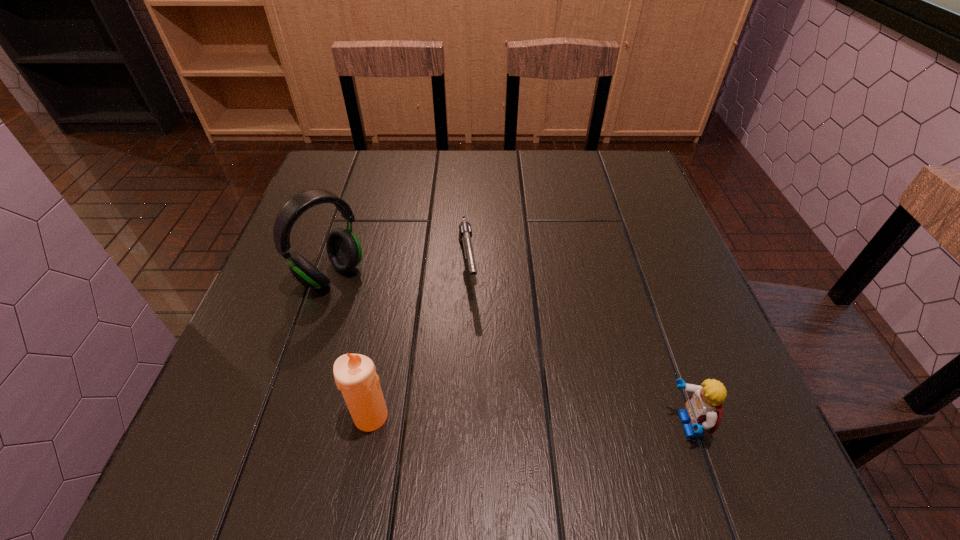
This screenshot has height=540, width=960. I want to click on object that is at the near right corner, so click(x=703, y=411).

The height and width of the screenshot is (540, 960). In order to click on vacant region at the far edge of the desktop in this screenshot , I will do `click(391, 159)`.

You are a GUI agent. You are given a task and a screenshot of the screen. Output one action in this format:
    pyautogui.click(x=<x>, y=<y>)
    Task: Click on the vacant space at the near edge of the desktop
    Image resolution: width=960 pixels, height=540 pixels.
    Given the screenshot: What is the action you would take?
    pyautogui.click(x=445, y=418)

In the image, there is a desktop. Identify the location of free space at the left edge. (304, 344).

Image resolution: width=960 pixels, height=540 pixels. Find the location of `vacant space at the right edge of the desktop`. vacant space at the right edge of the desktop is located at coordinates (634, 262).

You are a GUI agent. You are given a task and a screenshot of the screen. Output one action in this format:
    pyautogui.click(x=<x>, y=<y>)
    Task: Click on the free space at the far left corner of the desktop
    This screenshot has width=960, height=540.
    Given the screenshot: What is the action you would take?
    pyautogui.click(x=342, y=153)

Where is `vacant region at the far right corner of the desktop`? vacant region at the far right corner of the desktop is located at coordinates (597, 152).

Image resolution: width=960 pixels, height=540 pixels. I want to click on vacant space that is in between the second shortest object and the third object from right to left, so click(x=529, y=421).

Identify the location of empty location between the third tallest object and the gun. (577, 345).

This screenshot has height=540, width=960. Identify the location of unoccupied position between the gun and the headset. (399, 271).